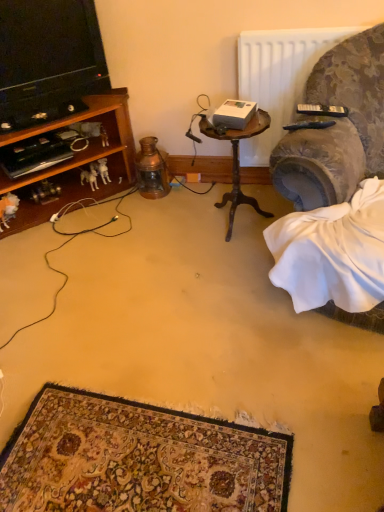
This screenshot has height=512, width=384. Identify the location of vacant space situated on the left part of wooden table at center. (177, 229).